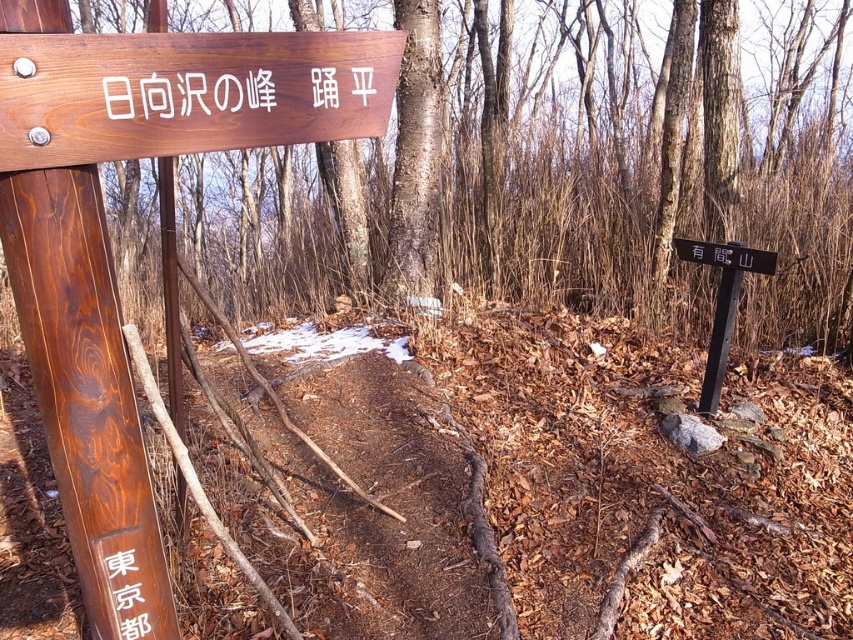
Is white wood sign at upper left above black wood sign at lower left?

Yes.

Between point (215, 84) and point (125, 596), which one is positioned behind?

The point (125, 596) is more distant.

Find the location of a particular element. This screenshot has width=853, height=640. white wood sign at upper left is located at coordinates (187, 93).

Which is more to the right, wooden sign at upper left or black metal signpost at right?

From the viewer's perspective, black metal signpost at right appears more on the right side.

Is wooden sign at upper left thinner than black metal signpost at right?

Incorrect, wooden sign at upper left's width is not less than black metal signpost at right's.

This screenshot has height=640, width=853. Find the location of `wooden sign at upper left`. wooden sign at upper left is located at coordinates (187, 92).

Can you confirm if brown wooden signpost at upper left is positioned to the right of black wood sign at lower left?

In fact, brown wooden signpost at upper left is to the left of black wood sign at lower left.

Who is positioned more to the right, brown wooden signpost at upper left or black wood sign at lower left?

From the viewer's perspective, black wood sign at lower left appears more on the right side.

The height and width of the screenshot is (640, 853). I want to click on brown wooden signpost at upper left, so click(83, 381).